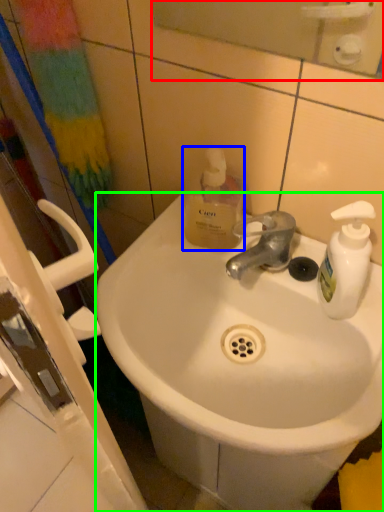
Question: Considering the real-world distances, which object is farthest from mirror (highlighted by a red box)? bottle (highlighted by a blue box) or sink (highlighted by a green box)?

Choices:
 (A) bottle
 (B) sink

Answer: (B)